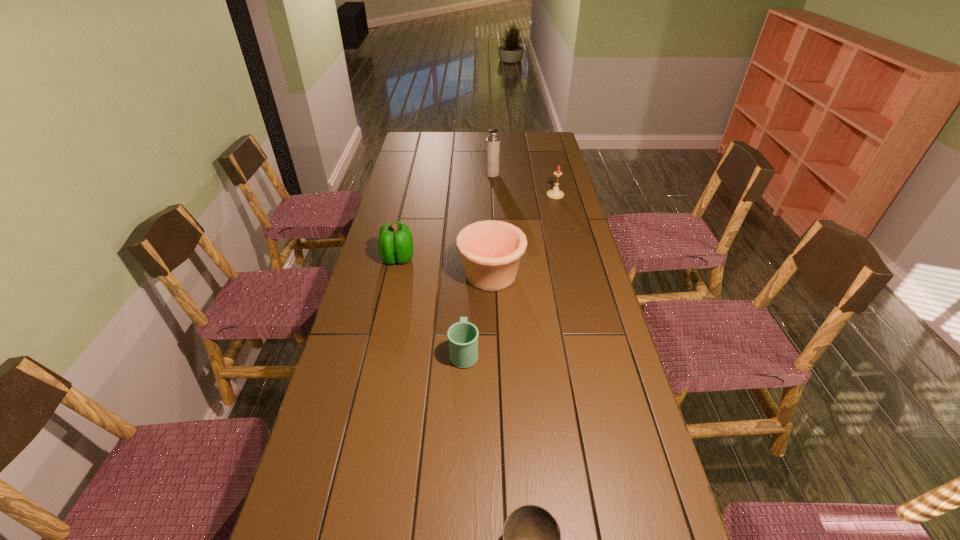
Image resolution: width=960 pixels, height=540 pixels. In order to click on vacant space located on the front of the leftmost object in this screenshot , I will do `click(394, 279)`.

You are a GUI agent. You are given a task and a screenshot of the screen. Output one action in this format:
    pyautogui.click(x=<x>, y=<y>)
    Task: Click on the vacant space located 0.140m on the front of the candle
    The width and height of the screenshot is (960, 540).
    Given the screenshot: What is the action you would take?
    pyautogui.click(x=561, y=217)

This screenshot has height=540, width=960. I want to click on free spot located on the side of the second shortest object with the handle, so click(x=467, y=286).

The image size is (960, 540). I want to click on free spot located on the side of the second shortest object with the handle, so click(x=465, y=321).

I want to click on vacant space situated 0.340m on the side of the second shortest object with the handle, so click(x=467, y=267).

The image size is (960, 540). Identify the location of object at the left edge. (395, 243).

At what (x,y) coordinates should I click in order to perform the action: click on object that is at the right edge. Please return your answer as a coordinate pair (x, y). Looking at the image, I should click on (555, 193).

Where is `vacant space at the far edge of the desktop`? vacant space at the far edge of the desktop is located at coordinates (478, 136).

The width and height of the screenshot is (960, 540). In order to click on vacant space at the left edge in this screenshot , I will do `click(368, 259)`.

In the image, there is a desktop. In order to click on free region at the right edge in this screenshot , I will do `click(569, 215)`.